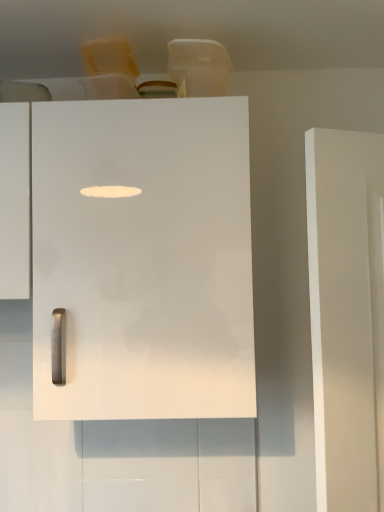
Where is `white glossy cupboard at center`? This screenshot has width=384, height=512. white glossy cupboard at center is located at coordinates (144, 258).

This screenshot has width=384, height=512. Describe the element at coordinates (144, 258) in the screenshot. I see `white glossy cupboard at center` at that location.

Measure the distance between white glossy cupboard at center and camera.

They are 36.75 inches apart.

Where is `white glossy cupboard at center`? This screenshot has height=512, width=384. white glossy cupboard at center is located at coordinates (144, 258).